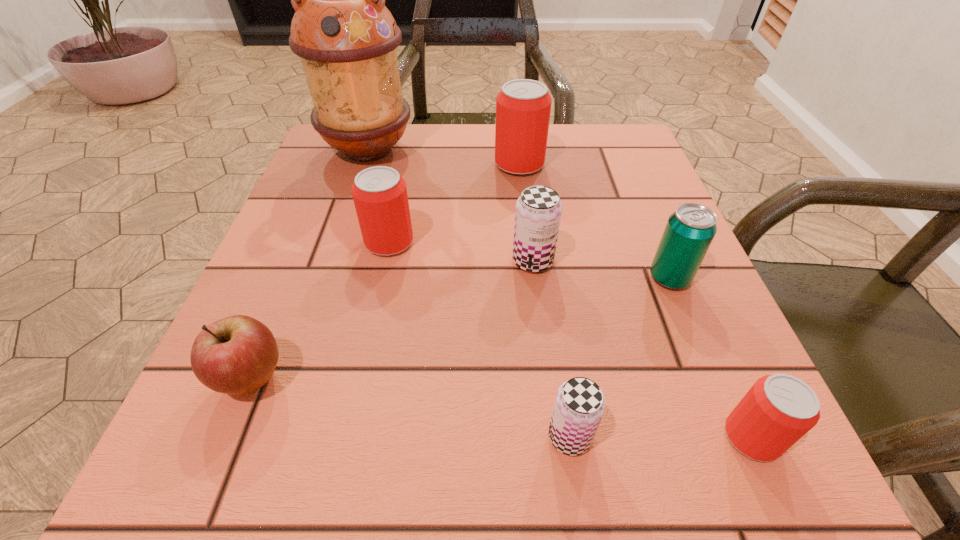
Where is `oil lamp`? This screenshot has height=540, width=960. oil lamp is located at coordinates (346, 38).

You are a GUI agent. You are given a task and a screenshot of the screen. Output one action in this format:
    pyautogui.click(x=<x>, y=<y>)
    Task: Click on the second red beer can from left to right
    Image resolution: width=960 pixels, height=540 pixels.
    Given the screenshot: What is the action you would take?
    pyautogui.click(x=523, y=106)

Identify the location of the farthest red beer can. The height and width of the screenshot is (540, 960). (523, 106).

Find the location of a particular element. Image resolution: width=960 pixels, height=540 pixels. the second nearest red beer can is located at coordinates (379, 193).

The width and height of the screenshot is (960, 540). What are the coordinates of `the leftmost red beer can` in the screenshot? It's located at (379, 193).

The height and width of the screenshot is (540, 960). In order to click on the farther purple beer can in this screenshot , I will do `click(538, 212)`.

Locate an element on the screen. teal beer can is located at coordinates (690, 230).

I want to click on red apple, so click(x=238, y=354).

The width and height of the screenshot is (960, 540). In order to click on the sixth farthest object in this screenshot , I will do `click(238, 354)`.

I want to click on the smaller purple beer can, so click(579, 406).